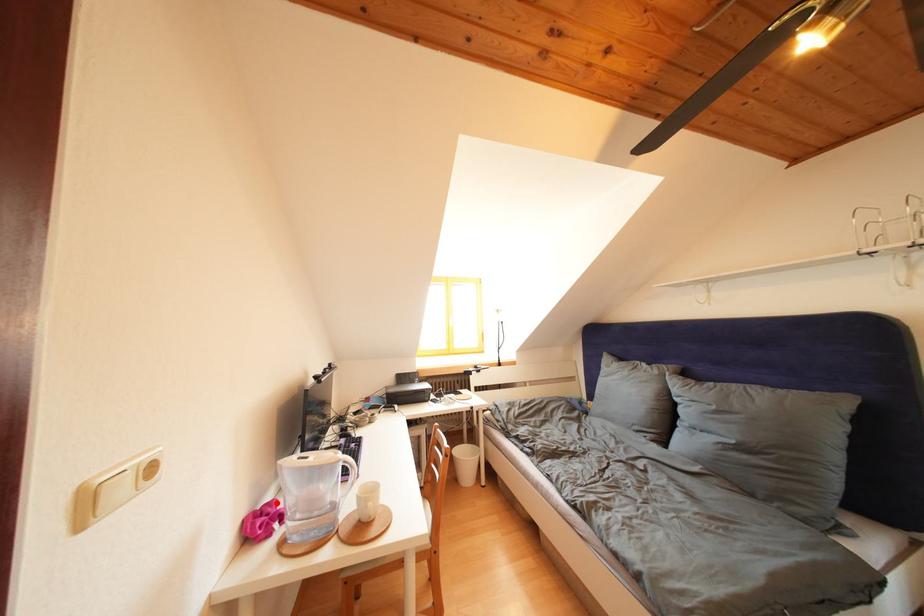
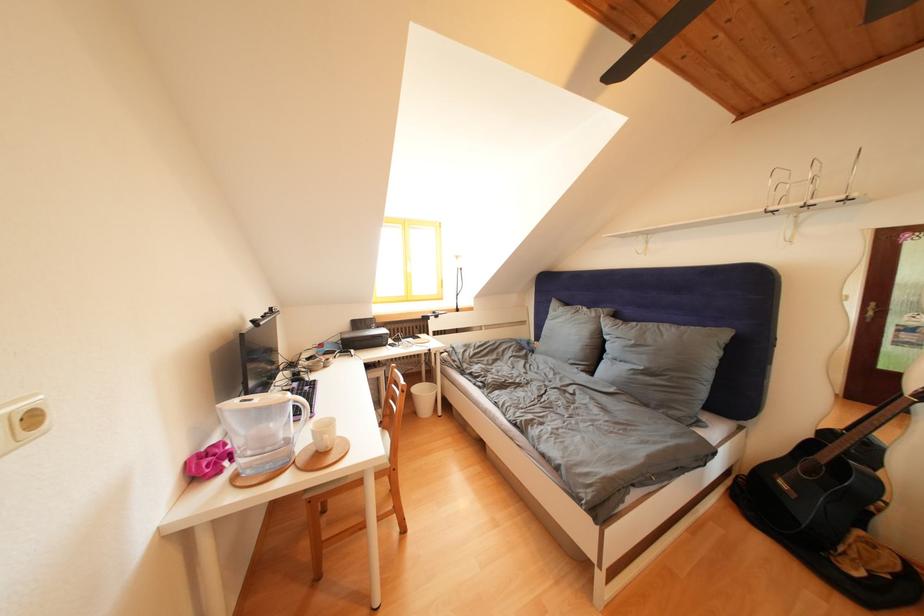
Locate, in the second image, the point that corresponds to the highlighted location in the first image.

(223, 446)